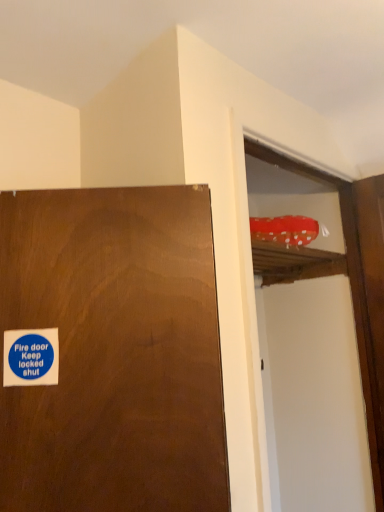
Question: In terms of width, does red polka dot fabric at upper right look wider or thinner when compared to blue paper sticker at lower left?

Choices:
 (A) wide
 (B) thin

Answer: (A)

Question: Is red polka dot fabric at upper right inside the boundaries of blue paper sticker at lower left, or outside?

Choices:
 (A) inside
 (B) outside

Answer: (B)

Question: Is red polka dot fabric at upper right taller or shorter than blue paper sticker at lower left?

Choices:
 (A) tall
 (B) short

Answer: (A)

Question: Considering the positions of blue paper sticker at lower left and red polka dot fabric at upper right in the image, is blue paper sticker at lower left taller or shorter than red polka dot fabric at upper right?

Choices:
 (A) short
 (B) tall

Answer: (A)

Question: Is blue paper sticker at lower left in front of or behind red polka dot fabric at upper right in the image?

Choices:
 (A) front
 (B) behind

Answer: (A)

Question: Choose the correct answer: Is blue paper sticker at lower left inside red polka dot fabric at upper right or outside it?

Choices:
 (A) inside
 (B) outside

Answer: (B)

Question: In the image, is blue paper sticker at lower left on the left side or the right side of red polka dot fabric at upper right?

Choices:
 (A) right
 (B) left

Answer: (B)